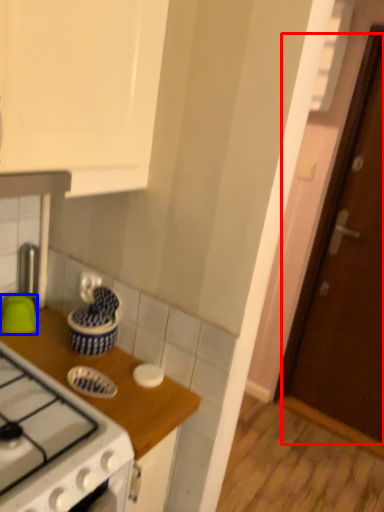
Question: Which point is closer to the camera, door (highlighted by a red box) or kitchen appliance (highlighted by a blue box)?

Choices:
 (A) door
 (B) kitchen appliance

Answer: (B)